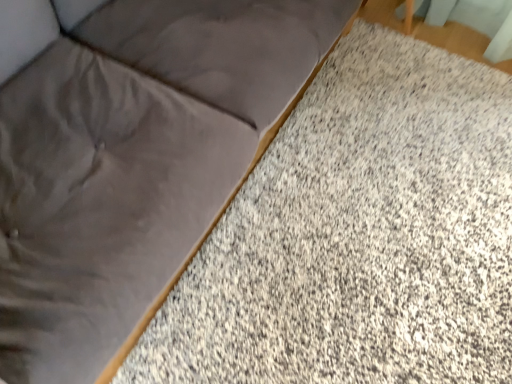
The height and width of the screenshot is (384, 512). What do you see at coordinates (128, 156) in the screenshot?
I see `matte gray cushion at upper left` at bounding box center [128, 156].

The width and height of the screenshot is (512, 384). Identify the location of matte gray cushion at upper left. (128, 156).

The image size is (512, 384). What are the coordinates of `matte gray cushion at upper left` in the screenshot? It's located at (128, 156).